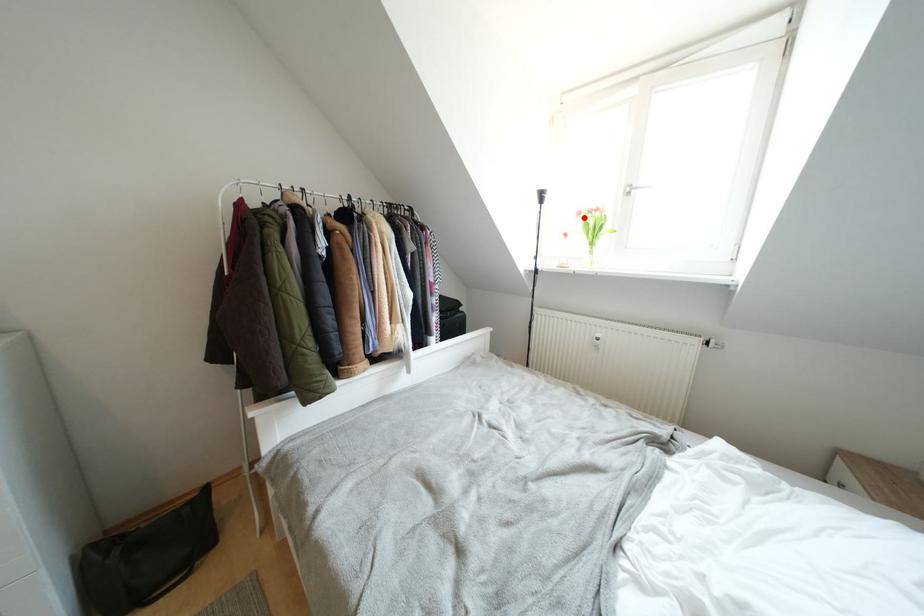
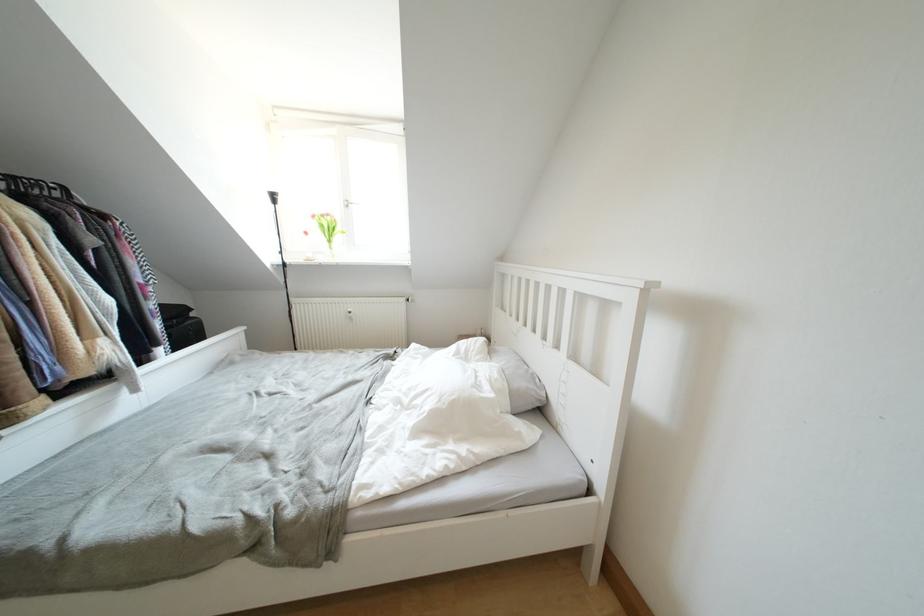
The point at the highlighted location is marked in the first image. Where is the corresponding point in the second image?

(319, 220)